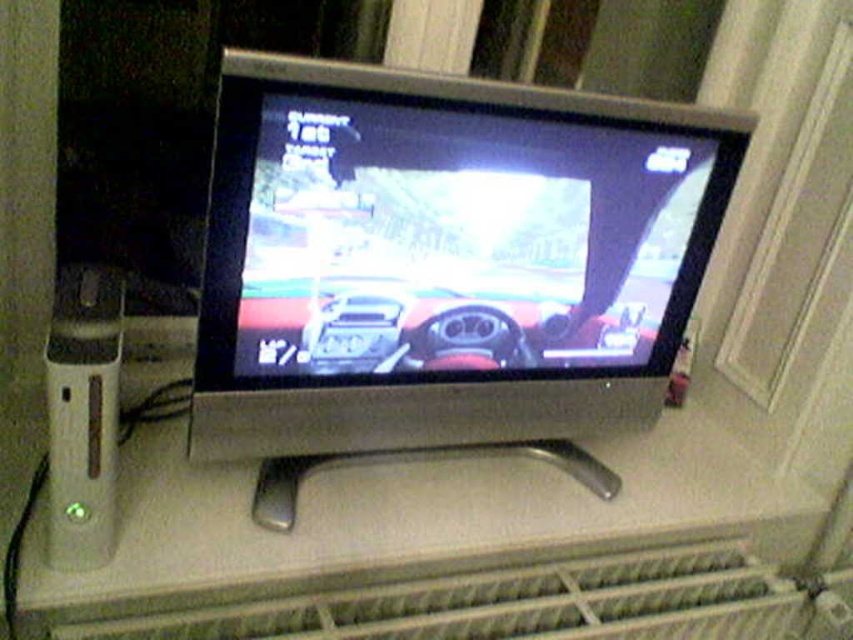
Does shiny black monitor at center appear over gray metallic radiator at lower center?

Correct, shiny black monitor at center is located above gray metallic radiator at lower center.

Can you confirm if shiny black monitor at center is wider than gray metallic radiator at lower center?

No.

Between point (241, 348) and point (149, 625), which one is positioned in front?

Point (149, 625) is more forward.

Find the location of `shiny black monitor at center`. shiny black monitor at center is located at coordinates (461, 240).